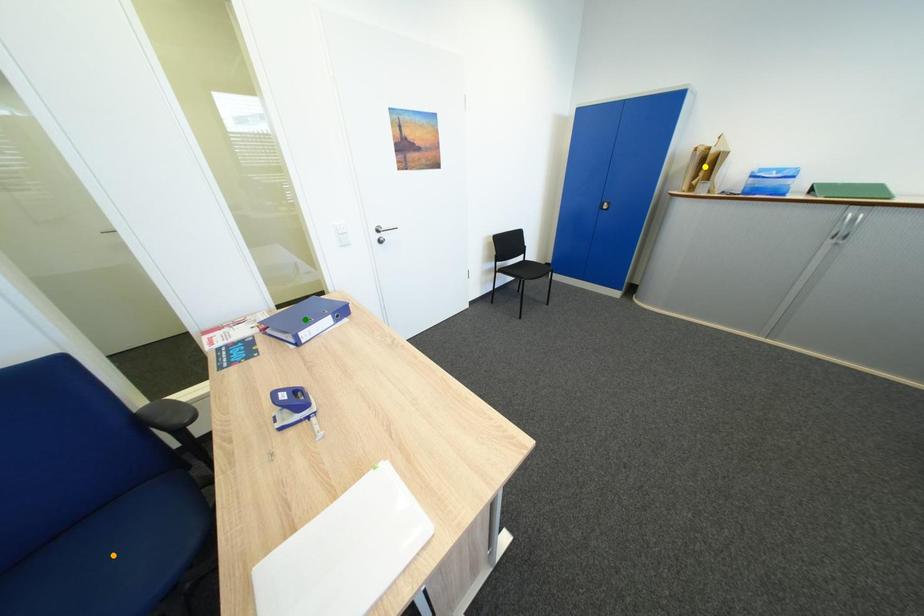
In the scene shown: Order these from nearest to farthest:
- green point
- orange point
- yellow point

1. yellow point
2. green point
3. orange point